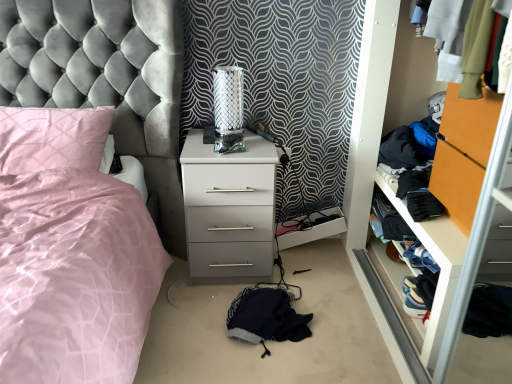
Locate an element on the screen. free space between fuzzy dark blue blanket at lower center, the first clothing ordered from the bottom, and denim jeans at lower right, the 2th clothing from the top is located at coordinates (345, 315).